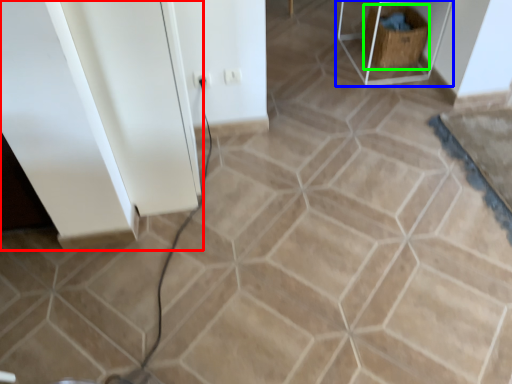
Question: Considering the real-world distances, which object is farthest from cabinetry (highlighted by a red box)? furniture (highlighted by a blue box) or crate (highlighted by a green box)?

Choices:
 (A) furniture
 (B) crate

Answer: (B)